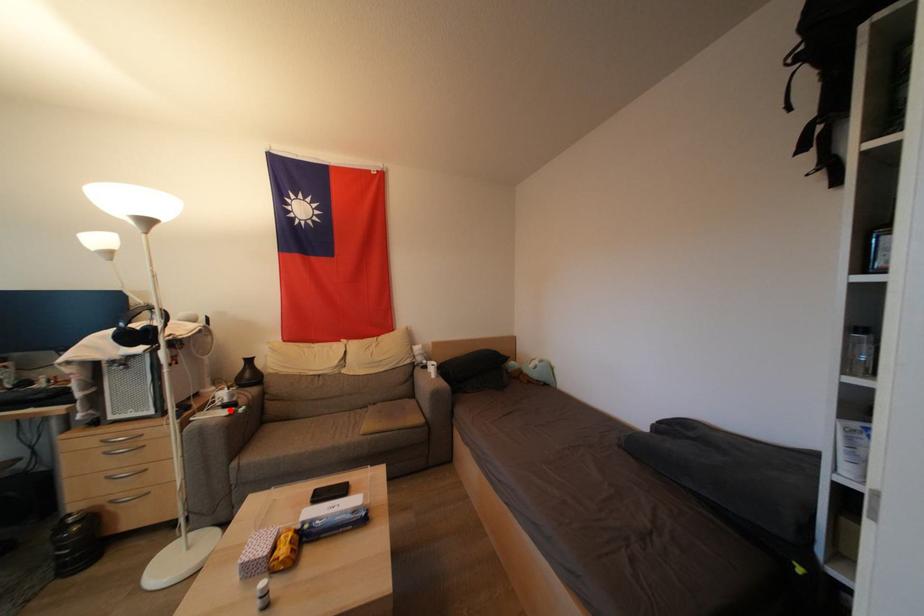
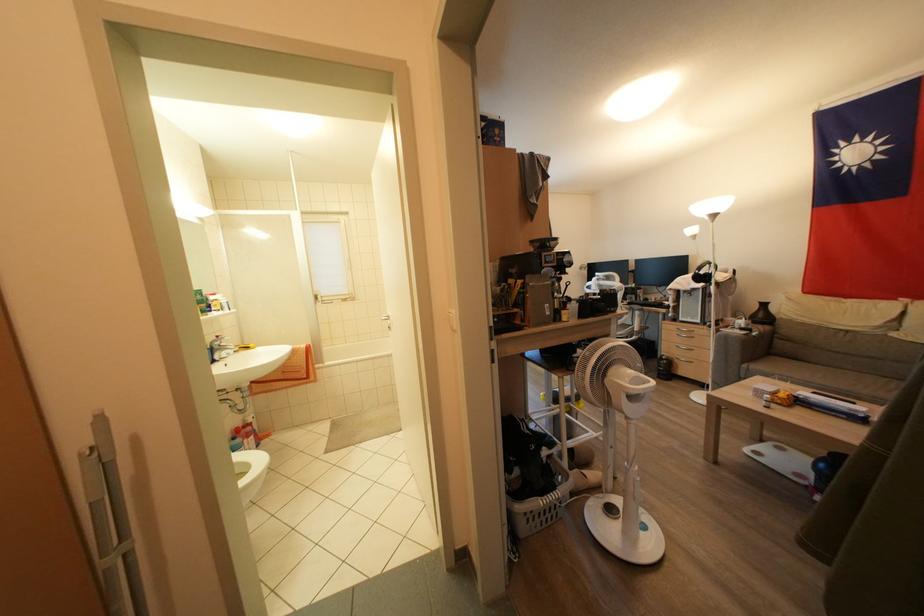
Locate, in the second image, the point that corresponds to the highlighted location in the first image.

(747, 333)